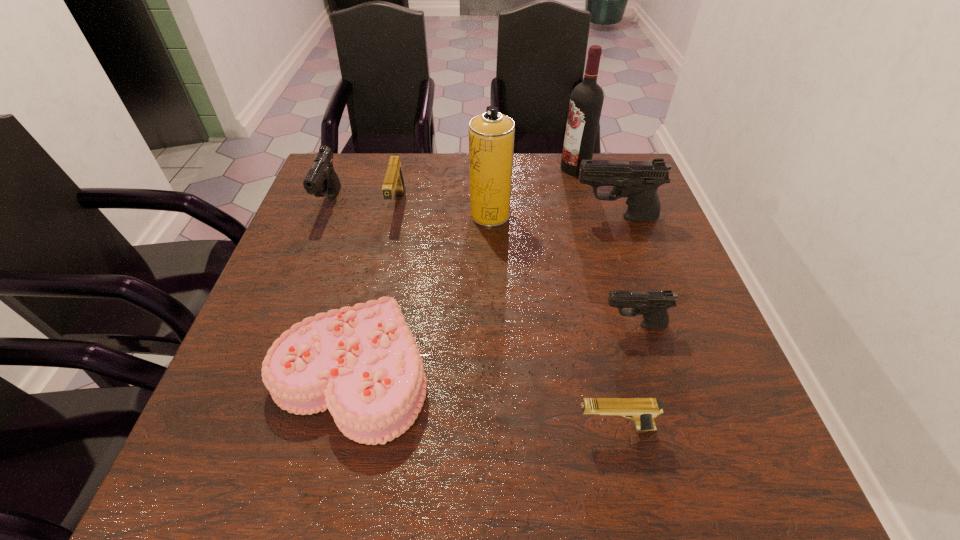
You are a GUI agent. You are given a task and a screenshot of the screen. Output one action in this format:
    pyautogui.click(x=<x>, y=<y>)
    Task: Click on the vacant space that's between the cake and the smallest black pistol
    
    Given the screenshot: What is the action you would take?
    pyautogui.click(x=492, y=349)

Where is `free space between the second nearest pistol and the fourth tallest object`? free space between the second nearest pistol and the fourth tallest object is located at coordinates (482, 264).

Identify the location of free space between the farther tan pistol and the second smallest black pistol. (364, 204).

Identify the location of vacant space that is in between the cake and the tallest pistol. (483, 295).

At what (x,y) coordinates should I click in order to perform the action: click on object that is the sixth nearest to the fourth pistol from right to left. Please return your answer as a coordinate pair (x, y). The width and height of the screenshot is (960, 540). Looking at the image, I should click on (653, 305).

Point out which object is positioned as the seventh nearest to the cake. Please provide its 2D coordinates. Your answer should be formatted as a tuple, i.e. [(x, y)], where the tuple contains the x and y coordinates of a point satisfying the conditions above.

[(586, 101)]

Point out which pistol is positioned as the second nearest to the nearest black pistol. Please provide its 2D coordinates. Your answer should be formatted as a tuple, i.e. [(x, y)], where the tuple contains the x and y coordinates of a point satisfying the conditions above.

[(638, 180)]

Locate which pistol is the second closest to the second pistol from left to right. Please provide its 2D coordinates. Your answer should be formatted as a tuple, i.e. [(x, y)], where the tuple contains the x and y coordinates of a point satisfying the conditions above.

[(638, 180)]

The image size is (960, 540). I want to click on black pistol that stands as the closest to the second biggest black pistol, so click(x=638, y=180).

Identify the location of black pistol that is the closest to the fifth shortest object. (638, 180).